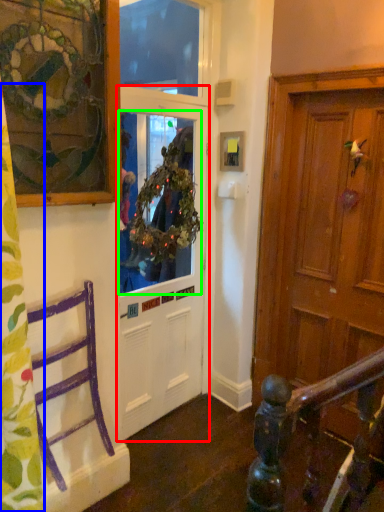
Question: Which object is positioned farthest from door (highlighted by a red box)? Select from curtain (highlighted by a blue box) and window screen (highlighted by a green box).

Choices:
 (A) curtain
 (B) window screen

Answer: (A)